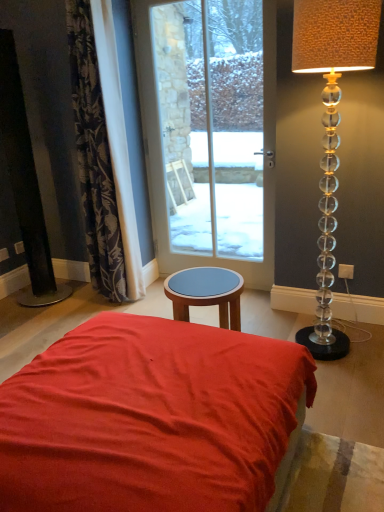
Question: Is dark floral fabric curtain at left closer to camera compared to translucent glass lamp at right?

Choices:
 (A) yes
 (B) no

Answer: (B)

Question: Is dark floral fabric curtain at left positioned far away from translucent glass lamp at right?

Choices:
 (A) yes
 (B) no

Answer: (A)

Question: Does dark floral fabric curtain at left appear on the right side of translucent glass lamp at right?

Choices:
 (A) yes
 (B) no

Answer: (B)

Question: Is dark floral fabric curtain at left next to translucent glass lamp at right and touching it?

Choices:
 (A) no
 (B) yes

Answer: (A)

Question: Can you confirm if dark floral fabric curtain at left is taller than translucent glass lamp at right?

Choices:
 (A) yes
 (B) no

Answer: (A)

Question: From the image's perspective, does dark floral fabric curtain at left appear lower than translucent glass lamp at right?

Choices:
 (A) no
 (B) yes

Answer: (A)

Question: Is matte red fabric bed at center to the left of dark floral fabric curtain at left from the viewer's perspective?

Choices:
 (A) yes
 (B) no

Answer: (B)

Question: Is matte red fabric bed at center positioned behind dark floral fabric curtain at left?

Choices:
 (A) no
 (B) yes

Answer: (A)

Question: From a real-world perspective, is matte red fabric bed at center below dark floral fabric curtain at left?

Choices:
 (A) yes
 (B) no

Answer: (A)

Question: Can you confirm if matte red fabric bed at center is smaller than dark floral fabric curtain at left?

Choices:
 (A) yes
 (B) no

Answer: (B)

Question: From the image's perspective, would you say matte red fabric bed at center is positioned over dark floral fabric curtain at left?

Choices:
 (A) yes
 (B) no

Answer: (B)

Question: Is matte red fabric bed at center to the right of dark floral fabric curtain at left from the viewer's perspective?

Choices:
 (A) no
 (B) yes

Answer: (B)

Question: Can dark floral fabric curtain at left be found inside clear glass door at center?

Choices:
 (A) yes
 (B) no

Answer: (B)